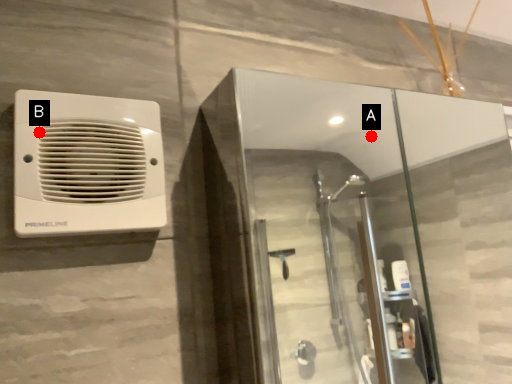
Question: Two points are circled on the image, labeled by A and B beside each circle. Which point is closer to the camera taking this photo?

Choices:
 (A) A is closer
 (B) B is closer

Answer: (B)